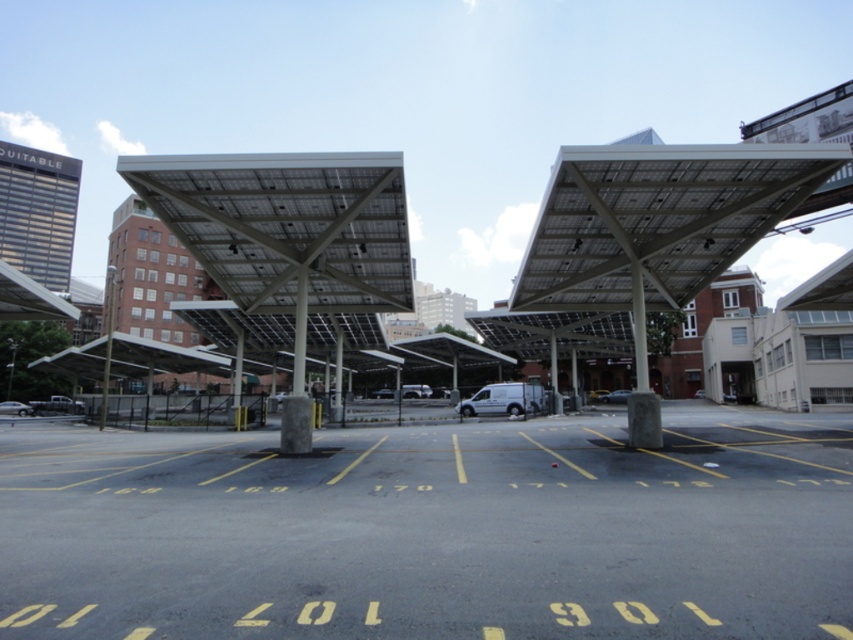
You are standing at the entrance of the parking lot and want to locate two specific points marked on the solar panel structure. The first point is at coordinate point (798, 452) and the second is at point (12, 410). Which point would you see higher up in your field of view?

Point (798, 452) is closer to the viewer than point (12, 410). Since it is closer, it would appear higher in your field of view compared to the farther point.

You are a delivery person standing at the entrance of the parking lot. You need to place a package in the trunk of the silver metallic car at lower left. However, there is a solar panel structure between you and the car. Can you safely walk around the solar panel structure to reach the car?

The silver metallic car at lower left is 57.02 meters away from the solar panel structure. Since the distance is sufficient, you can safely walk around the solar panel structure to reach the silver metallic car at lower left.

You are standing at the entrance of the parking lot and see two points marked in the image. The first point is at coordinate point(x=10, y=406) and the second is at point(x=618, y=390). Which point is closer to you?

Point(x=10, y=406) is in front of point(x=618, y=390), so it is closer to you.